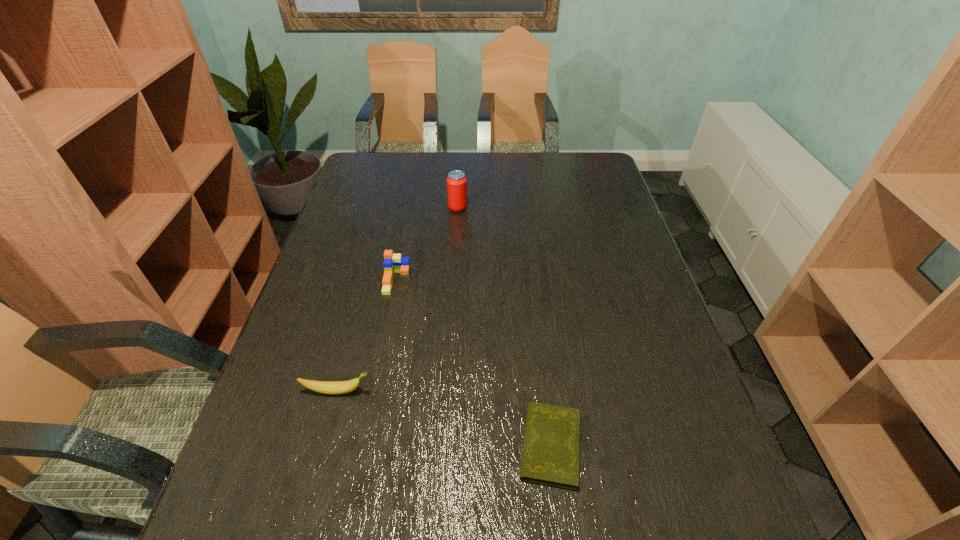
Locate an element on the screen. vacant area that lies between the banana and the second farthest object is located at coordinates (368, 336).

The width and height of the screenshot is (960, 540). I want to click on free spot between the diary and the tallest object, so click(504, 327).

Image resolution: width=960 pixels, height=540 pixels. Identify the location of free space between the third nearest object and the banana. (368, 336).

This screenshot has height=540, width=960. I want to click on free space between the nearest object and the third farthest object, so click(x=444, y=418).

The image size is (960, 540). I want to click on free space between the rightmost object and the Lego, so click(474, 363).

At what (x,y) coordinates should I click in order to perform the action: click on object that stands as the third closest to the shortest object. Please return your answer as a coordinate pair (x, y). Looking at the image, I should click on (456, 182).

The image size is (960, 540). I want to click on the closest object to the Lego, so click(456, 182).

Where is `free space that satisfies the following two spatial constraints: 1. on the front side of the third nearest object; 2. at the stem of the third farthest object`? This screenshot has width=960, height=540. free space that satisfies the following two spatial constraints: 1. on the front side of the third nearest object; 2. at the stem of the third farthest object is located at coordinates (375, 391).

The image size is (960, 540). Identify the location of free spot that satisfies the following two spatial constraints: 1. at the stem of the second nearest object; 2. on the left side of the shortest object. (324, 446).

This screenshot has height=540, width=960. Identify the location of vacant region that satisfies the following two spatial constraints: 1. at the stem of the nearest object; 2. on the right side of the banana. (324, 446).